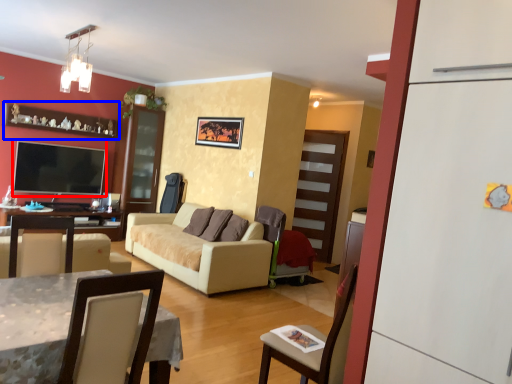
Question: Among these objects, which one is farthest to the camera, television (highlighted by a red box) or shelf (highlighted by a blue box)?

Choices:
 (A) television
 (B) shelf

Answer: (A)